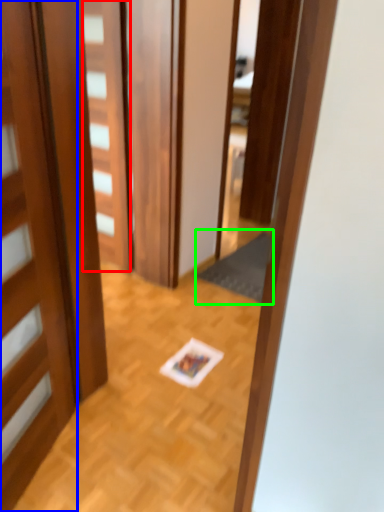
Question: Considering the real-world distances, which object is farthest from door (highlighted by a red box)? door (highlighted by a blue box) or doormat (highlighted by a green box)?

Choices:
 (A) door
 (B) doormat

Answer: (A)